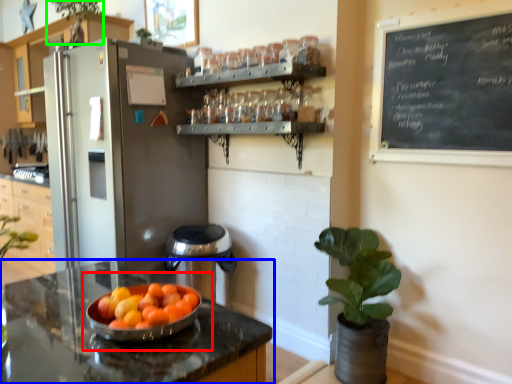
Question: Considering the real-world distances, which object is farthest from fruit dish (highlighted by a red box)? countertop (highlighted by a blue box) or plant (highlighted by a green box)?

Choices:
 (A) countertop
 (B) plant

Answer: (B)